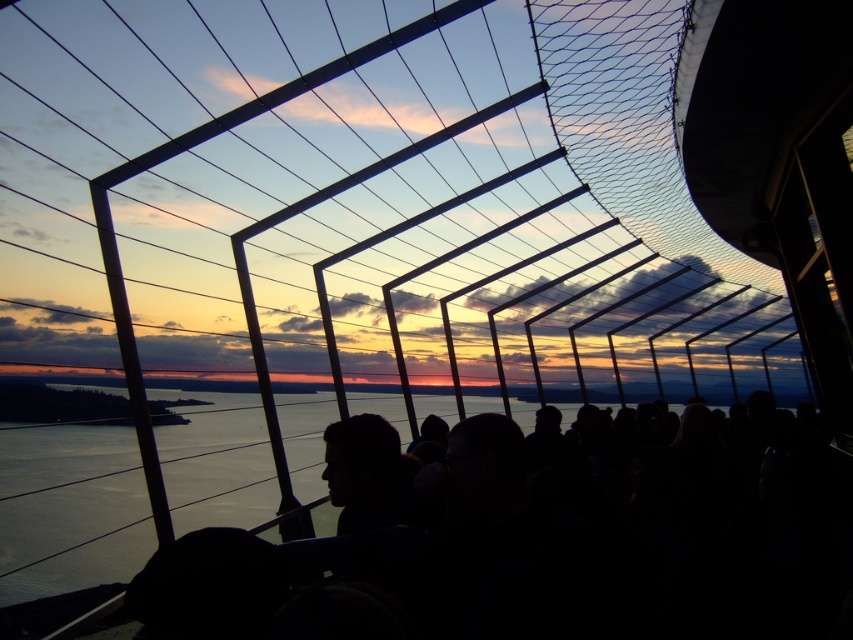
Question: Where is transparent glass water at lower left located in relation to dark hair at center in the image?

Choices:
 (A) left
 (B) right

Answer: (A)

Question: Does transparent glass water at lower left appear over dark hair at center?

Choices:
 (A) no
 (B) yes

Answer: (A)

Question: Does transparent glass water at lower left appear under dark hair at center?

Choices:
 (A) no
 (B) yes

Answer: (B)

Question: Which point is farther from the camera taking this photo?

Choices:
 (A) (10, 588)
 (B) (380, 428)

Answer: (A)